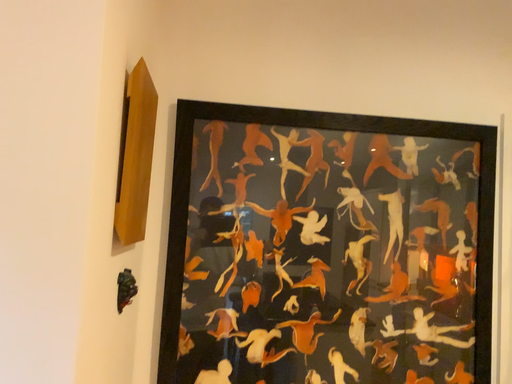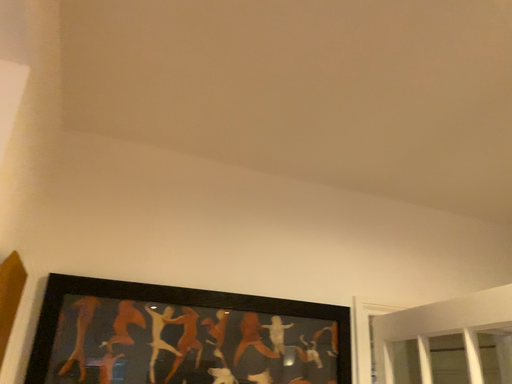
Question: Which way did the camera rotate in the video?

Choices:
 (A) rotated left
 (B) rotated right

Answer: (B)